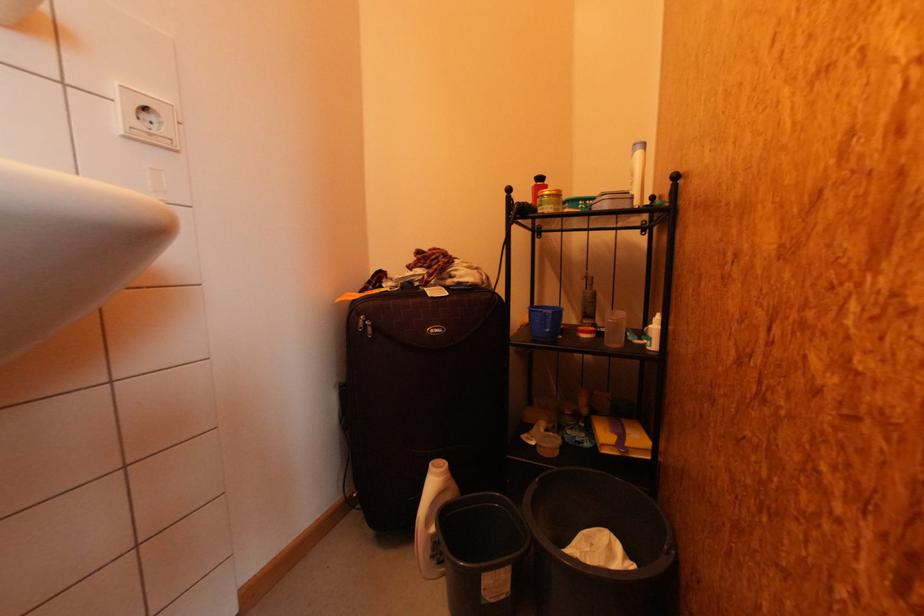
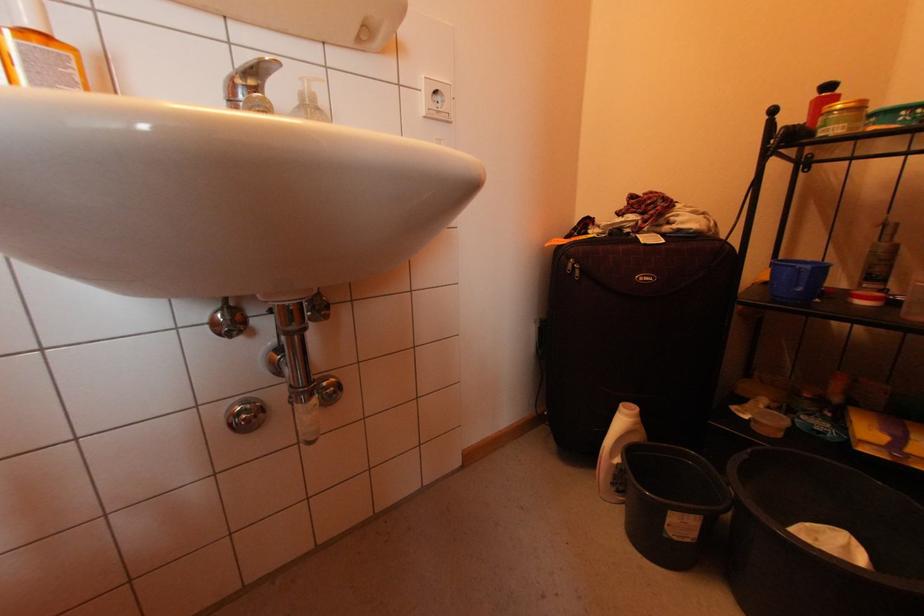
Question: How did the camera likely rotate?

Choices:
 (A) Left
 (B) Right
 (C) Up
 (D) Down

Answer: (A)